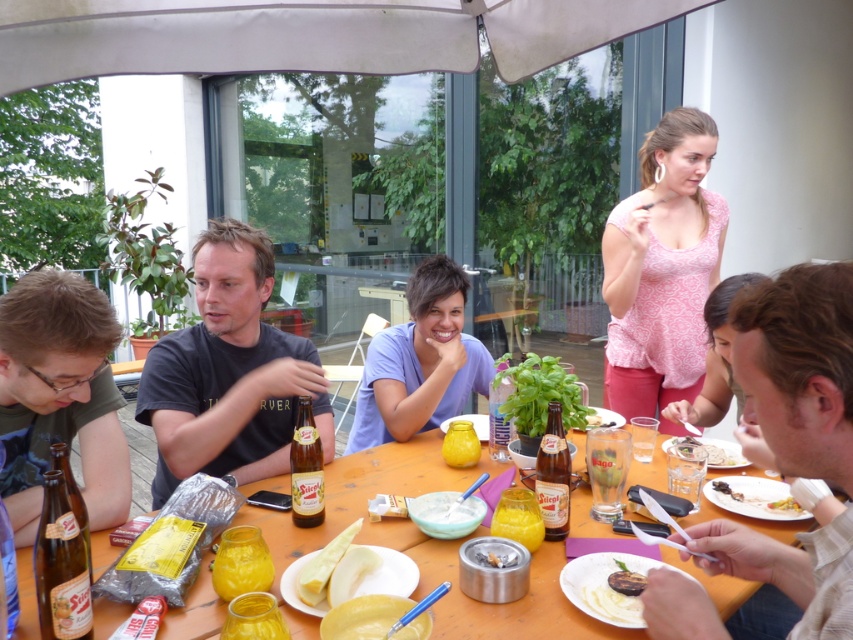
You are a guest at this outdoor gathering and want to place your phone on the table without blocking the view of the white glossy plate at lower right. Considering the size of the pink floral blouse at upper right, where should you place your phone?

The pink floral blouse at upper right is larger than the white glossy plate at lower right, so placing your phone on the table near the pink floral blouse at upper right would block the view of the plate. Instead, place your phone farther away from the blouse to keep the plate visible.

You are a guest at this gathering and need to place a small decorative item on the table. The item must be placed where it won not be easily knocked over. Considering the matte blue shirt at center and the smooth brown bread at lower center, which object should you place it near?

The smooth brown bread at lower center is smaller in size than the matte blue shirt at center, so placing the item near the matte blue shirt at center would provide a more stable and less crowded area, reducing the chance of it being knocked over.

You are standing at the entrance of the patio and want to greet the person wearing the matte blue shirt at center. According to the image coordinates, where should you look to find them?

The matte blue shirt at center is located at point (421, 362), so you should look towards those coordinates to find them.